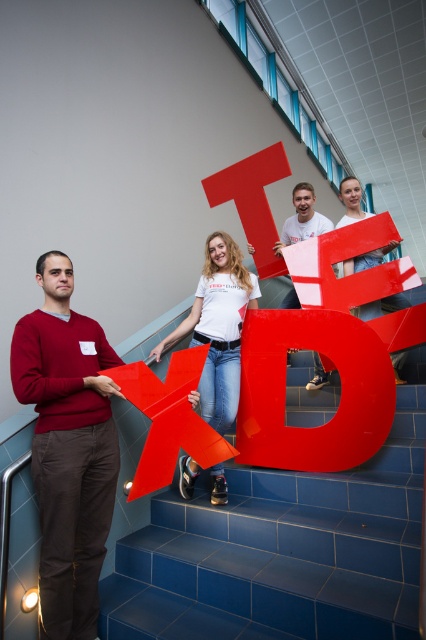
Question: Is glossy plastic letter d at center smaller than white matte t-shirt at center?

Choices:
 (A) no
 (B) yes

Answer: (B)

Question: Is matte red arrow at center positioned before matte plastic letter t at center?

Choices:
 (A) no
 (B) yes

Answer: (B)

Question: Among these points, which one is farthest from the camera?

Choices:
 (A) (149, 442)
 (B) (89, 620)
 (C) (230, 296)

Answer: (C)

Question: Among these objects, which one is farthest from the camera?

Choices:
 (A) matte red arrow at center
 (B) glossy plastic letter d at center

Answer: (B)

Question: Is white matte t-shirt at center above matte plastic letter t at center?

Choices:
 (A) no
 (B) yes

Answer: (A)

Question: Which object appears farthest from the camera in this image?

Choices:
 (A) glossy plastic letter d at center
 (B) white matte t-shirt at center
 (C) matte plastic letter t at center

Answer: (C)